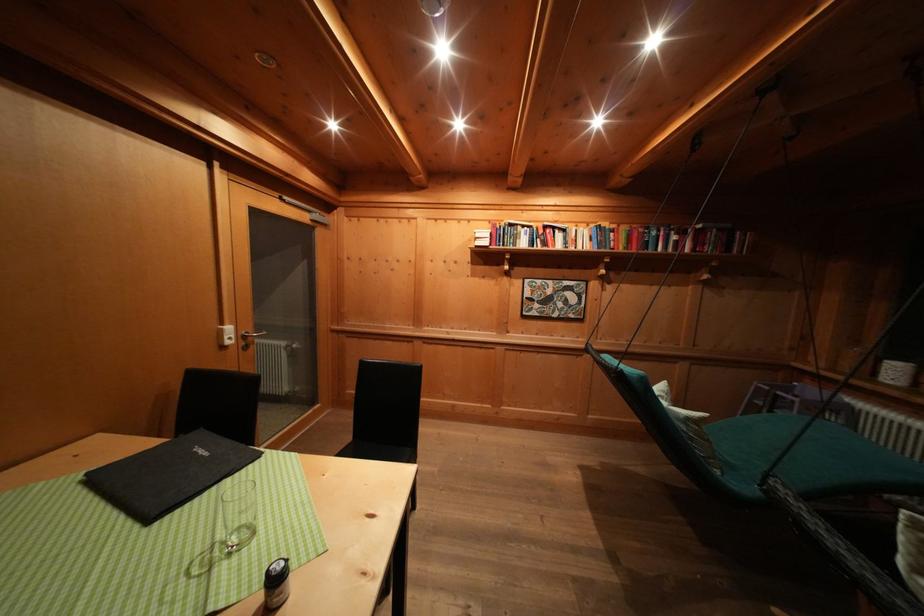
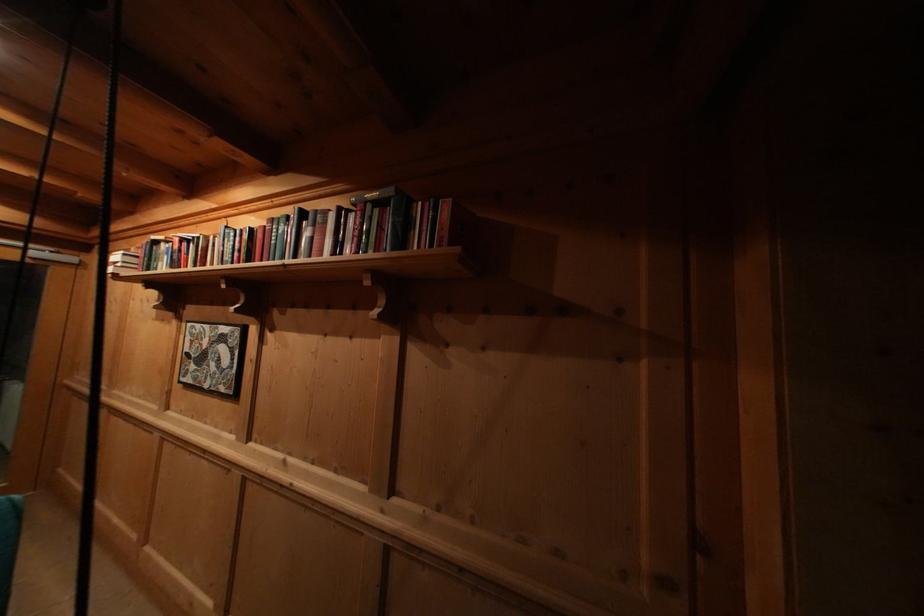
Where in the second image is the point corresponding to (552,232) from the first image?

(188, 246)